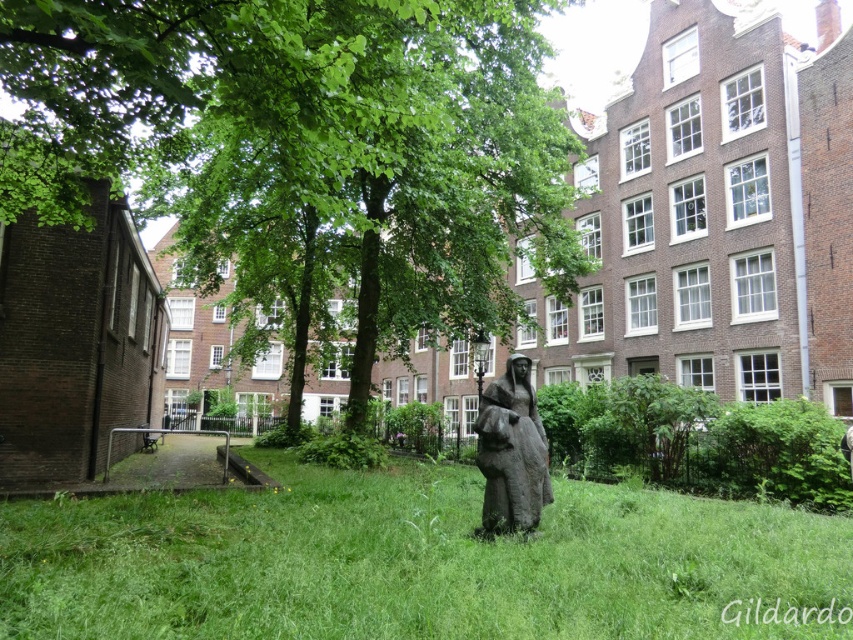
Does green leafy tree at center appear under bronze statue at center?

No.

Measure the distance from green leafy tree at center to bronze statue at center.

green leafy tree at center and bronze statue at center are 9.71 meters apart from each other.

Is point (125, 138) more distant than point (518, 364)?

Yes, point (125, 138) is farther from viewer.

The width and height of the screenshot is (853, 640). In order to click on green leafy tree at center in this screenshot , I will do `click(310, 147)`.

Which of these two, green leafy tree at center or green grassy at center, stands shorter?

Standing shorter between the two is green grassy at center.

Is the position of green leafy tree at center more distant than that of green grassy at center?

Yes.

Is point (297, 374) less distant than point (279, 634)?

No, it is not.

Identify the location of green leafy tree at center. Image resolution: width=853 pixels, height=640 pixels. (310, 147).

Can you confirm if green grassy at center is smaller than bronze statue at center?

Actually, green grassy at center might be larger than bronze statue at center.

Is green grassy at center in front of bronze statue at center?

Yes, it is.

At what (x,y) coordinates should I click in order to perform the action: click on green grassy at center. Please return your answer as a coordinate pair (x, y). The image size is (853, 640). Looking at the image, I should click on (416, 561).

Identify the location of green grassy at center. The image size is (853, 640). (416, 561).